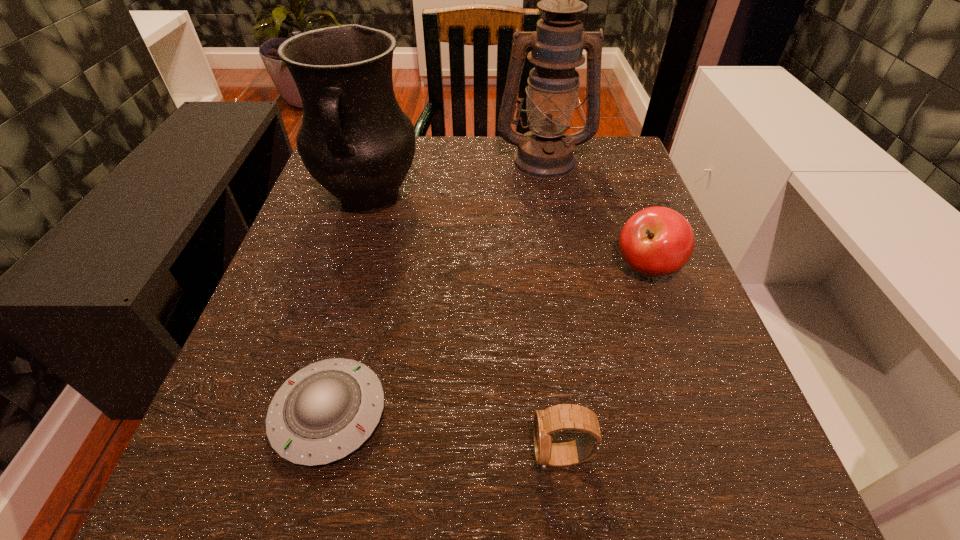
The width and height of the screenshot is (960, 540). I want to click on empty space that is in between the watch and the oil lamp, so click(553, 308).

Locate an element on the screen. vacant area between the third farthest object and the saucer is located at coordinates (488, 341).

The height and width of the screenshot is (540, 960). I want to click on free space between the pitcher and the oil lamp, so tap(456, 180).

Image resolution: width=960 pixels, height=540 pixels. Identify the location of unoccupied position between the oil lamp and the apple. (595, 214).

Where is `vacant point located between the apple and the watch`? The width and height of the screenshot is (960, 540). vacant point located between the apple and the watch is located at coordinates (604, 362).

Find the location of a particular element. The image size is (960, 540). free space that is in between the apple and the oil lamp is located at coordinates (595, 214).

The height and width of the screenshot is (540, 960). Find the location of `vacant area that lies between the oil lamp and the watch`. vacant area that lies between the oil lamp and the watch is located at coordinates (553, 308).

I want to click on unoccupied area between the watch and the pitcher, so click(466, 328).

The height and width of the screenshot is (540, 960). Identify the location of the second closest object to the third nearest object. (560, 417).

Where is `object that is the fourth closest to the oil lamp`? The width and height of the screenshot is (960, 540). object that is the fourth closest to the oil lamp is located at coordinates (560, 417).